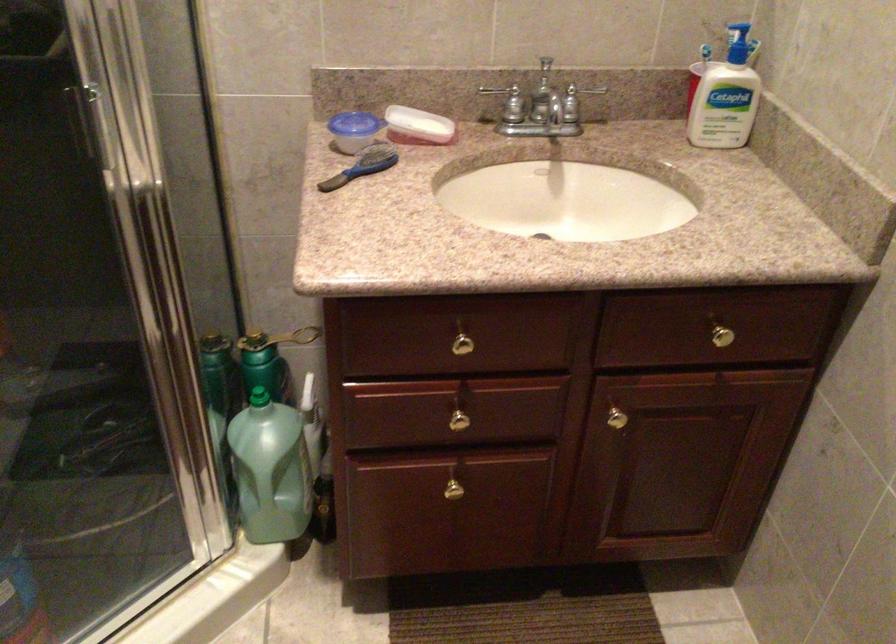
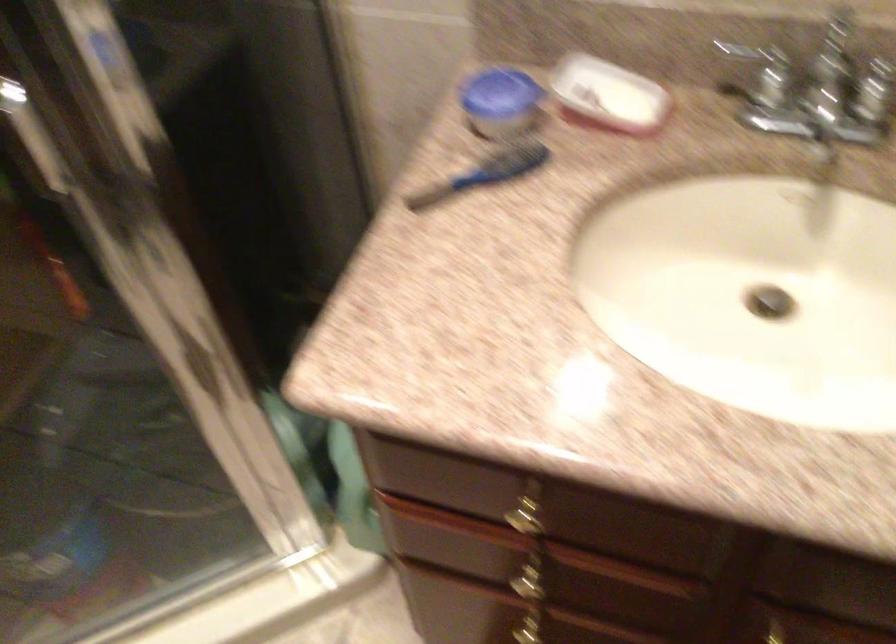
The images are taken continuously from a first-person perspective. In which direction are you moving?

The cameraman moved toward right, forward.